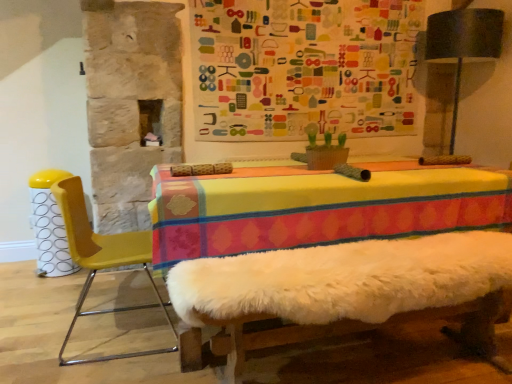
Identify the location of unoccupied space behind yellow plastic chair at left. The image size is (512, 384). (121, 293).